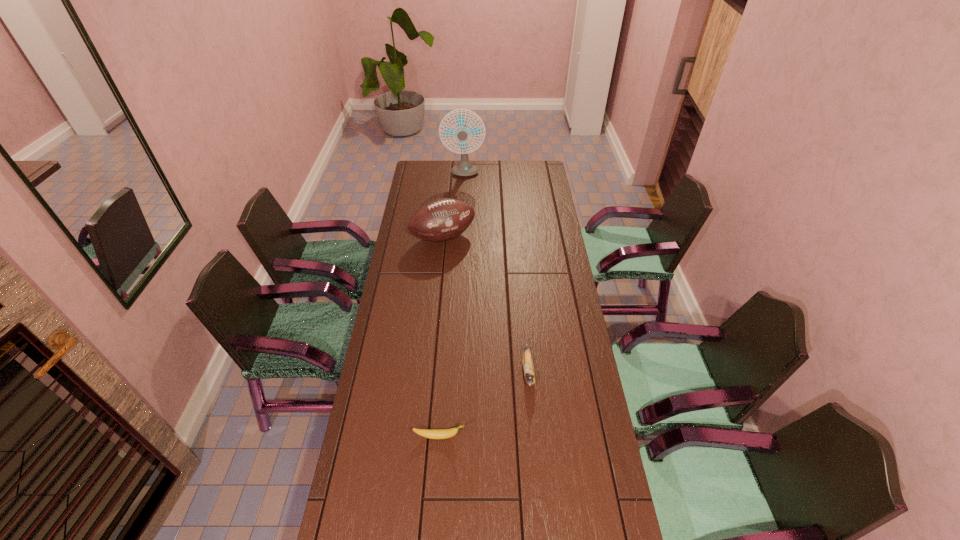
The height and width of the screenshot is (540, 960). I want to click on the farthest object, so click(464, 168).

Where is `fan`? fan is located at coordinates (464, 168).

The height and width of the screenshot is (540, 960). Find the location of `the third nearest object`. the third nearest object is located at coordinates (443, 219).

Where is `the third shortest object`? This screenshot has width=960, height=540. the third shortest object is located at coordinates 443,219.

You are a GUI agent. You are given a task and a screenshot of the screen. Output one action in this format:
    pyautogui.click(x=<x>, y=<y>)
    Task: Click on the right banana
    
    Given the screenshot: What is the action you would take?
    pyautogui.click(x=528, y=368)

Image resolution: width=960 pixels, height=540 pixels. What are the coordinates of `the second shortest object` in the screenshot? It's located at (528, 368).

The height and width of the screenshot is (540, 960). What are the coordinates of `the left banana` in the screenshot? It's located at (427, 433).

The image size is (960, 540). I want to click on the nearest object, so click(427, 433).

Where is `vacant space situated 0.290m on the front-facing side of the farthest object`? vacant space situated 0.290m on the front-facing side of the farthest object is located at coordinates (462, 214).

At what (x,y) coordinates should I click in order to perform the action: click on free space located on the right of the football (American). Please return your answer as a coordinate pair (x, y). Looking at the image, I should click on (557, 238).